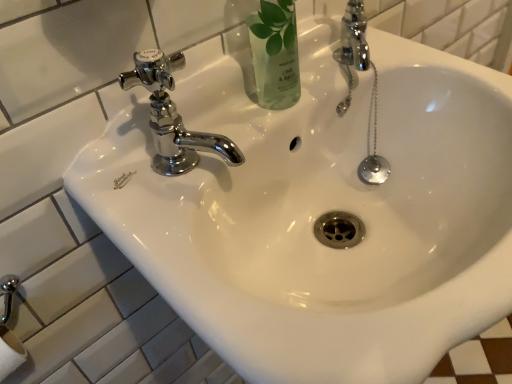
Question: Considering the positions of clear glass bottle at upper center and chrome/metallic faucet at upper left in the image, is clear glass bottle at upper center wider or thinner than chrome/metallic faucet at upper left?

Choices:
 (A) thin
 (B) wide

Answer: (B)

Question: Would you say clear glass bottle at upper center is to the left or to the right of chrome/metallic faucet at upper left in the picture?

Choices:
 (A) right
 (B) left

Answer: (A)

Question: Considering the positions of clear glass bottle at upper center and chrome/metallic faucet at upper left in the image, is clear glass bottle at upper center taller or shorter than chrome/metallic faucet at upper left?

Choices:
 (A) short
 (B) tall

Answer: (B)

Question: From a real-world perspective, is chrome/metallic faucet at upper left above or below clear glass bottle at upper center?

Choices:
 (A) below
 (B) above

Answer: (A)

Question: Looking at the image, does chrome/metallic faucet at upper left seem bigger or smaller compared to clear glass bottle at upper center?

Choices:
 (A) big
 (B) small

Answer: (B)

Question: Choose the correct answer: Is chrome/metallic faucet at upper left inside clear glass bottle at upper center or outside it?

Choices:
 (A) inside
 (B) outside

Answer: (B)

Question: Considering the positions of point (155, 79) and point (261, 29), is point (155, 79) closer or farther from the camera than point (261, 29)?

Choices:
 (A) closer
 (B) farther

Answer: (B)